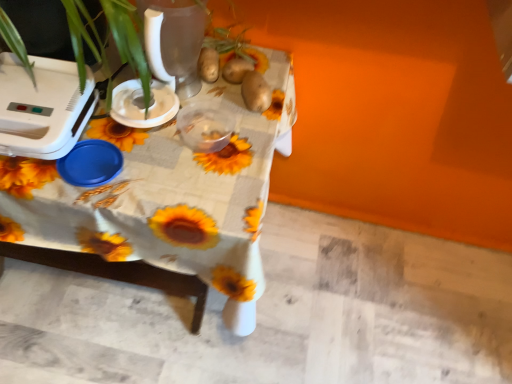
You are a GUI agent. You are given a task and a screenshot of the screen. Output one action in this format:
    pyautogui.click(x=<x>, y=<y>)
    Task: Click on the vacant area that is in front of brown matte potato at upper center
    This screenshot has width=512, height=384.
    Given the screenshot: What is the action you would take?
    pyautogui.click(x=232, y=119)